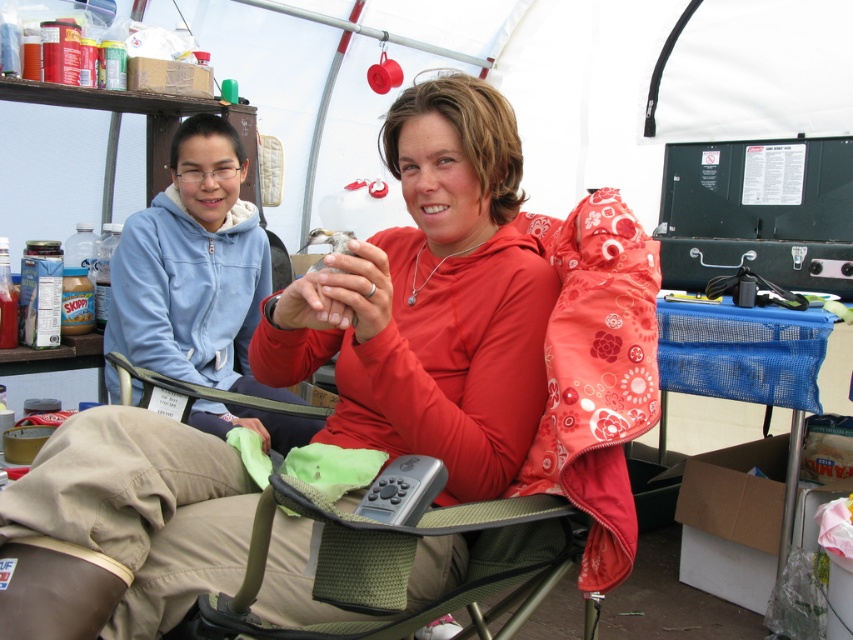
Question: Is matte red shirt at center further to the viewer compared to khaki fabric pants at lower center?

Choices:
 (A) yes
 (B) no

Answer: (B)

Question: Which of the following is the closest to the observer?

Choices:
 (A) (158, 474)
 (B) (20, 522)

Answer: (B)

Question: Observing the image, what is the correct spatial positioning of matte red shirt at center in reference to khaki fabric pants at lower center?

Choices:
 (A) left
 (B) right

Answer: (B)

Question: Which point is closer to the camera?

Choices:
 (A) khaki fabric pants at lower center
 (B) matte red shirt at center

Answer: (B)

Question: Which point is closer to the camera?

Choices:
 (A) khaki fabric pants at lower center
 (B) matte red shirt at center

Answer: (B)

Question: Is matte red shirt at center smaller than khaki fabric pants at lower center?

Choices:
 (A) no
 (B) yes

Answer: (A)